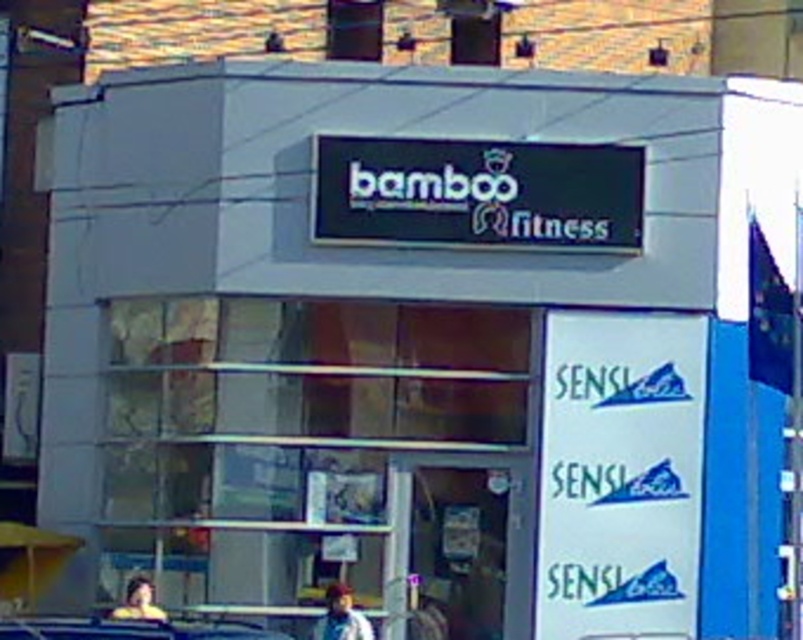
Question: Can you confirm if metallic silver car at lower center is positioned to the right of light brown hair at lower left?

Choices:
 (A) no
 (B) yes

Answer: (B)

Question: Which point is farther to the camera?

Choices:
 (A) (253, 625)
 (B) (329, 593)

Answer: (B)

Question: Which point appears farthest from the camera in this image?

Choices:
 (A) pyautogui.click(x=333, y=614)
 (B) pyautogui.click(x=129, y=584)
 (C) pyautogui.click(x=225, y=634)

Answer: (B)

Question: Is blue denim jacket at lower center to the right of light brown hair at lower left from the viewer's perspective?

Choices:
 (A) no
 (B) yes

Answer: (B)

Question: Does blue denim jacket at lower center have a larger size compared to light brown hair at lower left?

Choices:
 (A) no
 (B) yes

Answer: (A)

Question: Based on their relative distances, which object is nearer to the metallic silver car at lower center?

Choices:
 (A) light brown hair at lower left
 (B) blue denim jacket at lower center

Answer: (A)